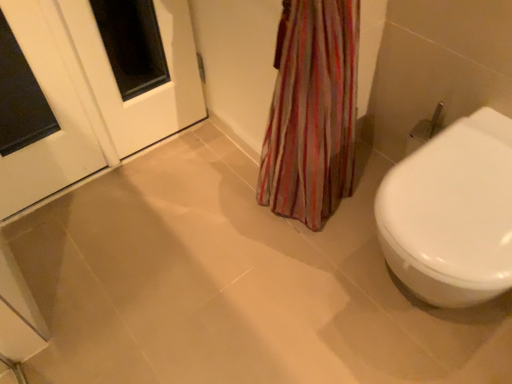
This screenshot has width=512, height=384. What are the coordinates of `space that is in front of white glossy door at upper left` in the screenshot? It's located at (161, 197).